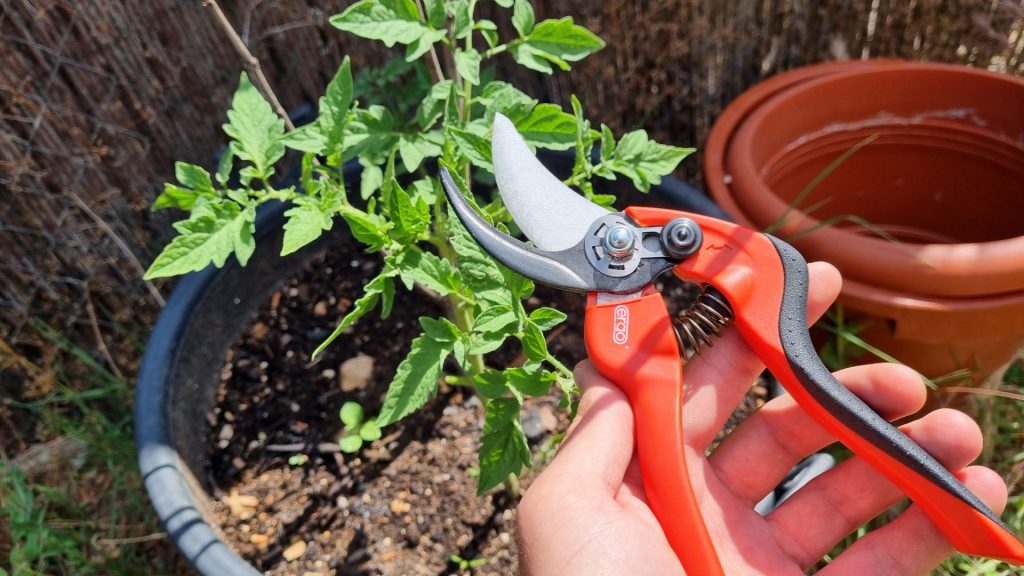
This screenshot has height=576, width=1024. I want to click on green leafy plant, so click(x=444, y=59).